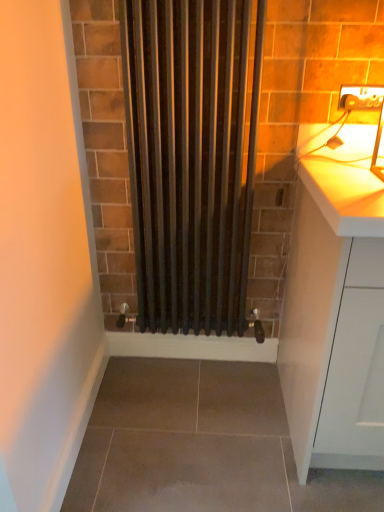
Question: Should I look upward or downward to see black matte radiator at center?

Choices:
 (A) up
 (B) down

Answer: (A)

Question: From a real-world perspective, does black matte radiator at center stand above matte white electric outlet at upper right?

Choices:
 (A) yes
 (B) no

Answer: (B)

Question: Are black matte radiator at center and matte white electric outlet at upper right located far from each other?

Choices:
 (A) yes
 (B) no

Answer: (B)

Question: Is black matte radiator at center turned away from matte white electric outlet at upper right?

Choices:
 (A) yes
 (B) no

Answer: (B)

Question: Is black matte radiator at center positioned before matte white electric outlet at upper right?

Choices:
 (A) yes
 (B) no

Answer: (A)

Question: From the image's perspective, is black matte radiator at center above matte white electric outlet at upper right?

Choices:
 (A) no
 (B) yes

Answer: (A)

Question: Is black matte radiator at center at the right side of matte white electric outlet at upper right?

Choices:
 (A) no
 (B) yes

Answer: (A)

Question: Can you confirm if matte white electric outlet at upper right is positioned to the left of white matte cabinet at right?

Choices:
 (A) no
 (B) yes

Answer: (B)

Question: Does matte white electric outlet at upper right have a greater width compared to white matte cabinet at right?

Choices:
 (A) yes
 (B) no

Answer: (B)

Question: Is there a large distance between matte white electric outlet at upper right and white matte cabinet at right?

Choices:
 (A) yes
 (B) no

Answer: (B)

Question: Can you confirm if matte white electric outlet at upper right is smaller than white matte cabinet at right?

Choices:
 (A) yes
 (B) no

Answer: (A)

Question: Is matte white electric outlet at upper right facing towards white matte cabinet at right?

Choices:
 (A) yes
 (B) no

Answer: (B)

Question: Is matte white electric outlet at upper right taller than white matte cabinet at right?

Choices:
 (A) no
 (B) yes

Answer: (A)

Question: From a real-world perspective, is white matte cabinet at right under black matte radiator at center?

Choices:
 (A) yes
 (B) no

Answer: (A)